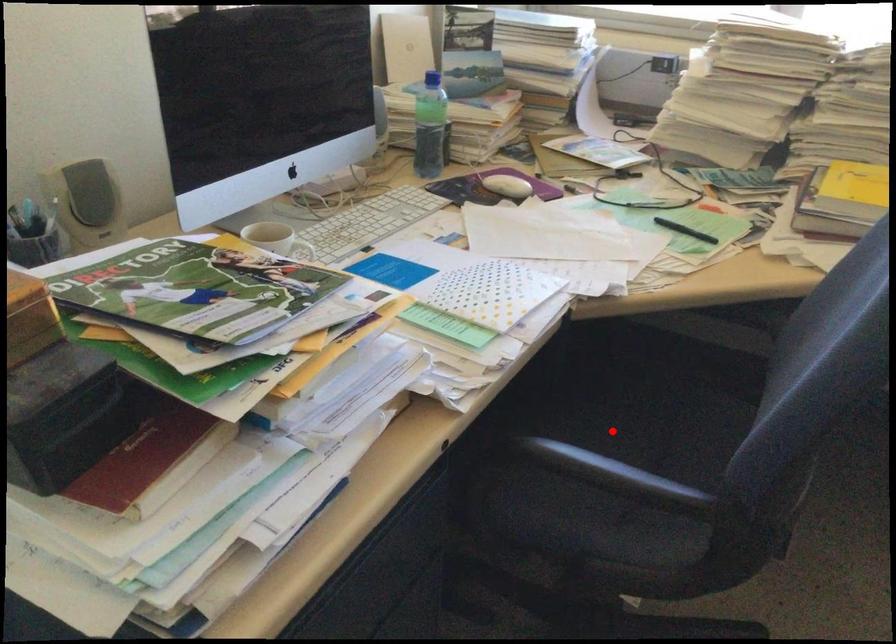
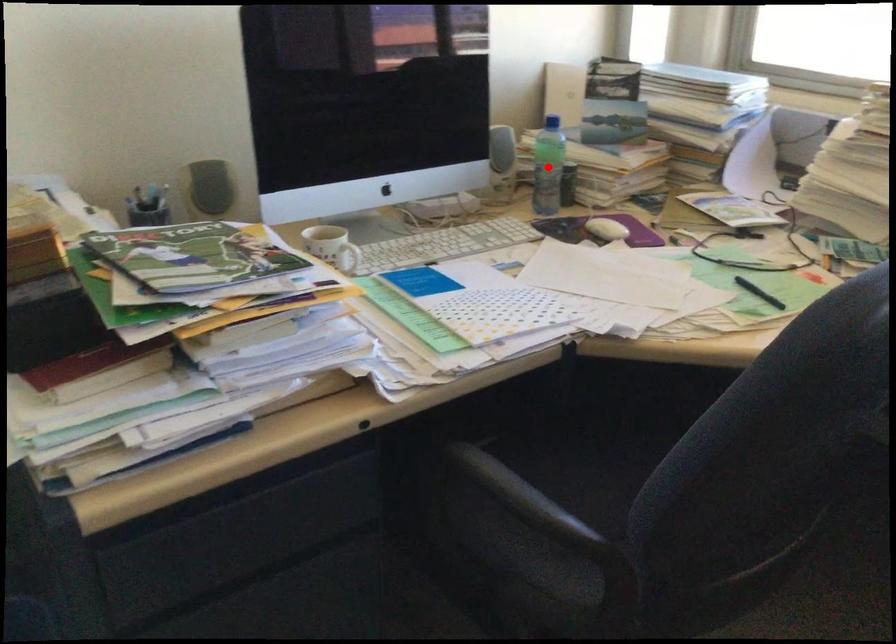
I am providing you with two images of the same scene from different viewpoints. A red point is marked on the first image and another point is marked on the second image. Does the point marked in image1 correspond to the same location as the one in image2?

No